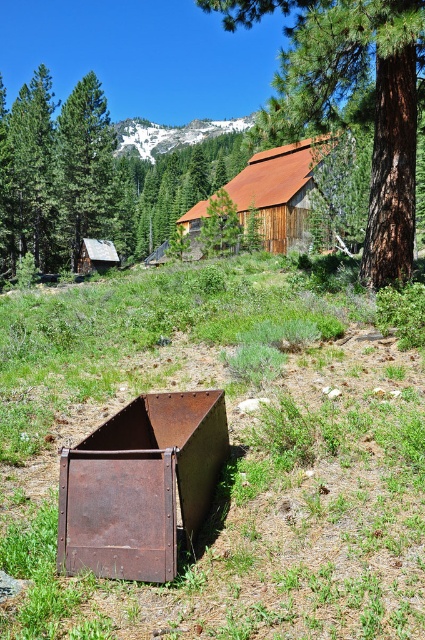
Question: Can you confirm if brown rough bark tree at upper center is positioned above green matte tree at upper left?

Choices:
 (A) no
 (B) yes

Answer: (A)

Question: Which point appears closest to the camera in this image?

Choices:
 (A) (96, 499)
 (B) (282, 548)
 (C) (62, 237)

Answer: (A)

Question: Among these points, which one is nearest to the camera?

Choices:
 (A) (193, 618)
 (B) (163, 556)

Answer: (A)

Question: Is rusty metal container at lower left below brown rough bark tree at upper center?

Choices:
 (A) no
 (B) yes

Answer: (B)

Question: Is rusty metal box at lower center wider than green matte tree at upper left?

Choices:
 (A) yes
 (B) no

Answer: (B)

Question: Which of these objects is positioned closest to the green matte tree at upper left?

Choices:
 (A) rusty metal box at lower center
 (B) brown rough bark tree at upper center

Answer: (B)